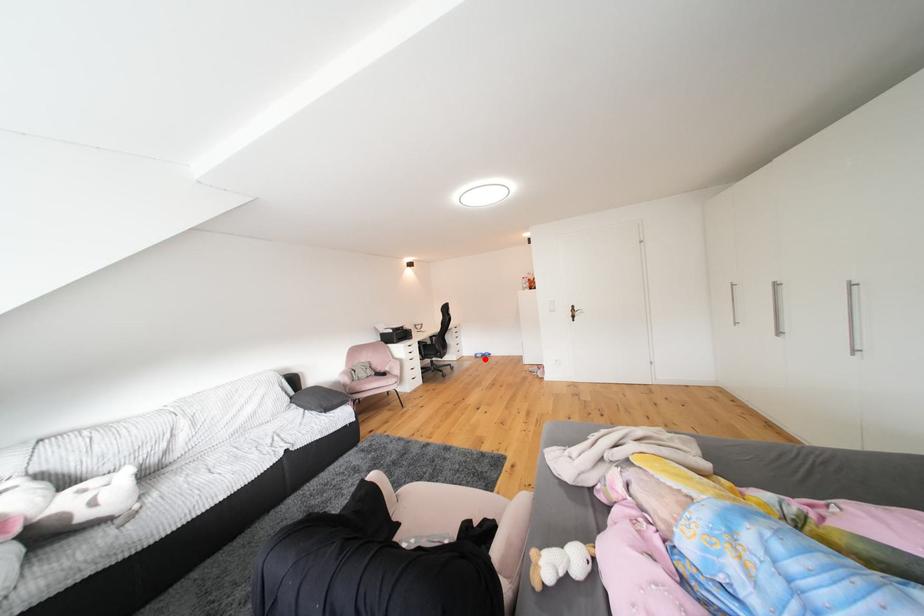
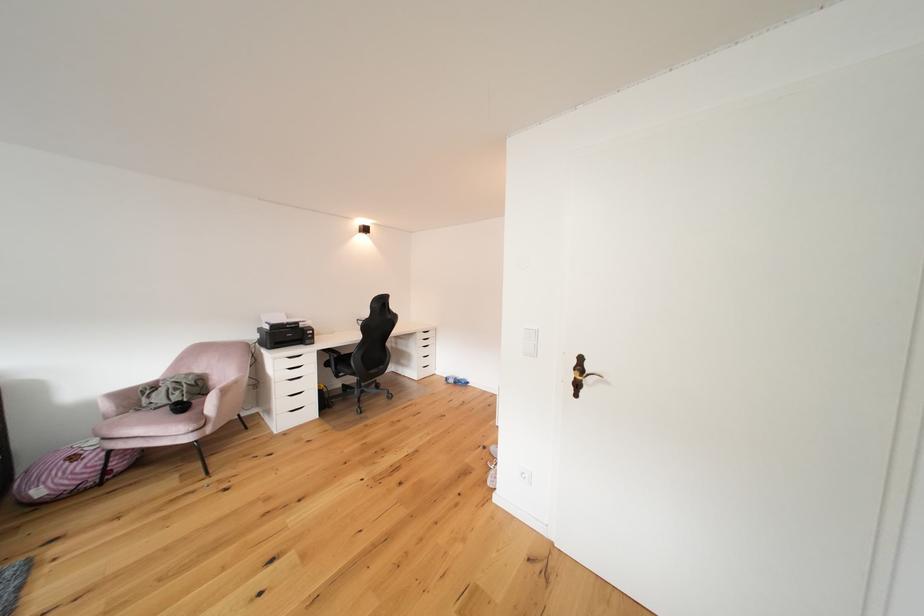
Question: I am providing you with two images of the same scene from different viewpoints. Image1 has a red point marked. In image2, the corresponding 3D location appears at what relative position? Reply with the corresponding letter.

Choices:
 (A) Closer
 (B) Farther

Answer: (B)